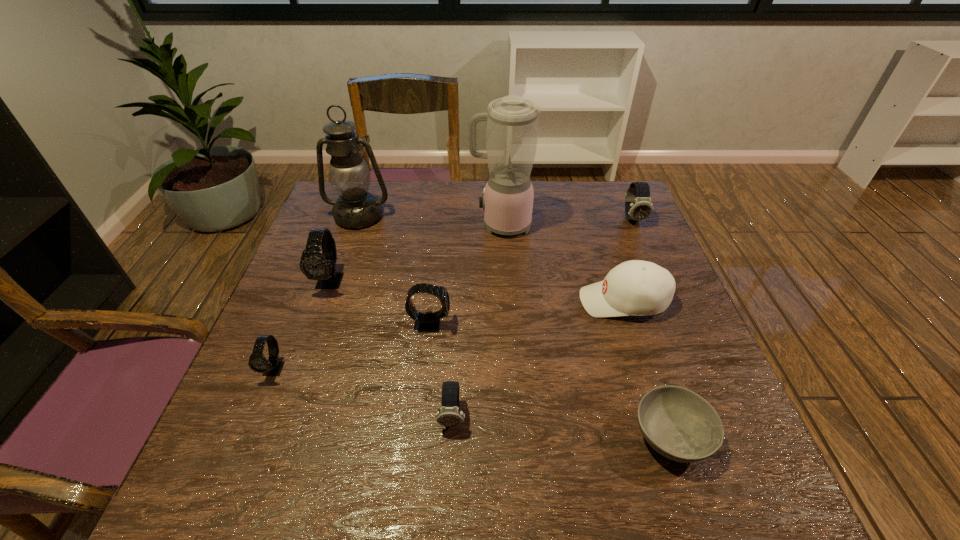
Image resolution: width=960 pixels, height=540 pixels. What are the coordinates of `the second nearest watch` in the screenshot? It's located at (258, 363).

Where is `the left dark watch`? This screenshot has width=960, height=540. the left dark watch is located at coordinates (449, 415).

Locate an element on the screen. the smaller dark watch is located at coordinates (449, 415).

Where is `the shortest object`? This screenshot has width=960, height=540. the shortest object is located at coordinates (679, 424).

Find the location of a particular element. Image resolution: width=960 pixels, height=540 pixels. free space located on the base of the food processor near the control knob is located at coordinates (436, 225).

Locate an element on the screen. vacant space located 0.300m on the base of the food processor near the control knob is located at coordinates (369, 225).

Find the location of a particular element. This screenshot has width=960, height=540. free space located on the base of the food processor near the control knob is located at coordinates (422, 225).

You are a GUI agent. You are given a task and a screenshot of the screen. Output one action in this format:
    pyautogui.click(x=<x>, y=<y>)
    Task: Click on the free space located 0.220m on the right of the oil lamp
    The image size is (960, 540).
    Given the screenshot: What is the action you would take?
    pyautogui.click(x=464, y=216)

Find the location of a particular element. The image size is (960, 540). vacant space located 0.140m on the face of the second farthest watch is located at coordinates (308, 344).

The image size is (960, 540). In order to click on blank space located 0.310m on the face of the third farthest watch in this screenshot , I will do `click(585, 324)`.